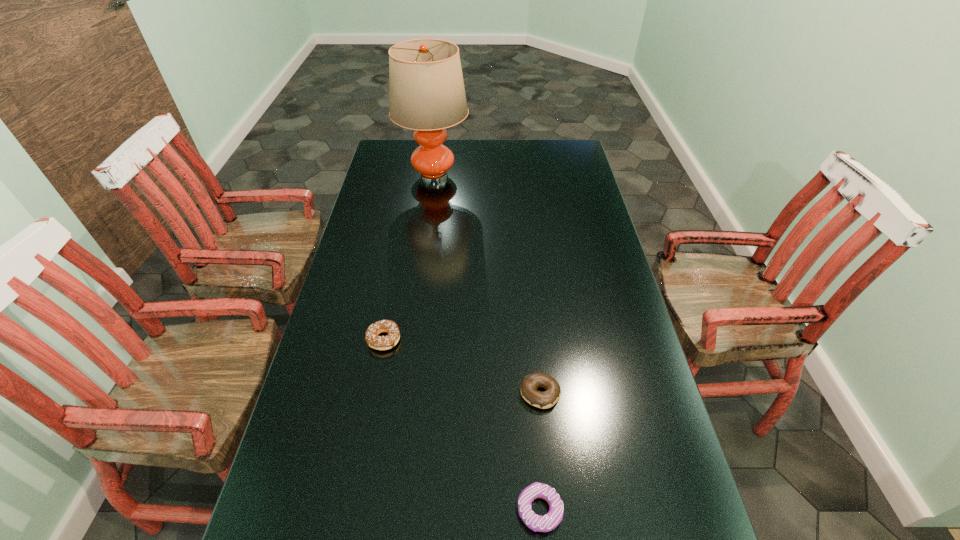
Locate an element on the screen. The image size is (960, 540). object present at the far edge is located at coordinates (426, 89).

Where is `lamp located in the left edge section of the desktop`? The height and width of the screenshot is (540, 960). lamp located in the left edge section of the desktop is located at coordinates (426, 89).

The width and height of the screenshot is (960, 540). In order to click on doughnut at the left edge in this screenshot , I will do `click(373, 340)`.

Image resolution: width=960 pixels, height=540 pixels. What are the coordinates of `object located at the far left corner` in the screenshot? It's located at (426, 89).

This screenshot has height=540, width=960. I want to click on free space at the far edge, so click(x=476, y=139).

You are a GUI agent. You are given a task and a screenshot of the screen. Output one action in this format:
    pyautogui.click(x=<x>, y=<y>)
    Task: Click on the free location at the left edge
    This screenshot has width=960, height=540.
    Given the screenshot: What is the action you would take?
    pyautogui.click(x=375, y=168)

Find the location of a particular element. free region at the right edge is located at coordinates (655, 511).

You are a GUI agent. You are given a task and a screenshot of the screen. Output one action in this format:
    pyautogui.click(x=<x>, y=<y>)
    Task: Click on the vacant point at the far left corner
    
    Given the screenshot: What is the action you would take?
    pyautogui.click(x=384, y=141)

Where is `vacant region at the far right corner of the desktop`? vacant region at the far right corner of the desktop is located at coordinates (557, 152).

Image resolution: width=960 pixels, height=540 pixels. I want to click on free space that is in between the nearest object and the third farthest object, so click(540, 451).